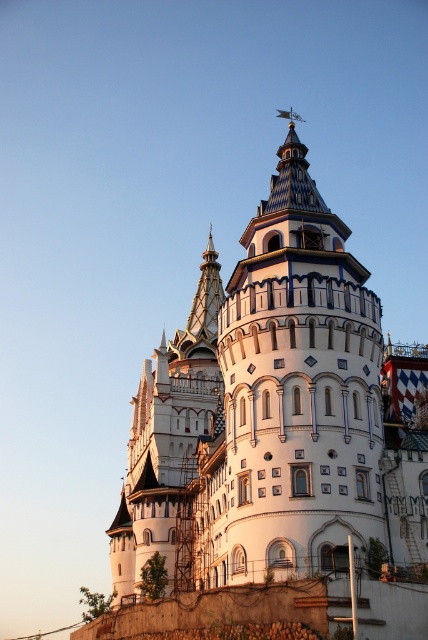
This screenshot has height=640, width=428. In order to click on white ceramic tower at center in this screenshot , I will do `click(294, 396)`.

At what (x,y) coordinates should I click in order to perform the action: click on white ceramic tower at center. Please return your answer as a coordinate pair (x, y). This screenshot has height=640, width=428. Looking at the image, I should click on coord(294,396).